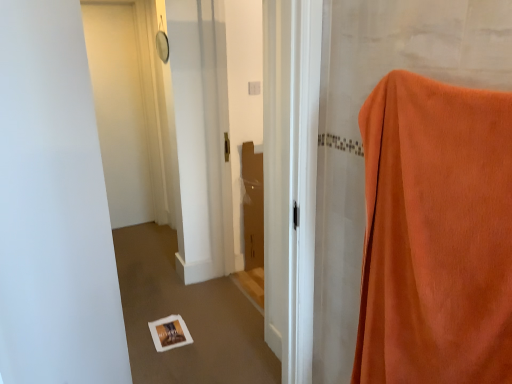
Question: Considering the relative sizes of orange velvety curtain at right and white matte door at upper left in the image provided, is orange velvety curtain at right bigger than white matte door at upper left?

Choices:
 (A) no
 (B) yes

Answer: (B)

Question: From the image's perspective, is orange velvety curtain at right over white matte door at upper left?

Choices:
 (A) no
 (B) yes

Answer: (A)

Question: From a real-world perspective, is orange velvety curtain at right located beneath white matte door at upper left?

Choices:
 (A) yes
 (B) no

Answer: (A)

Question: Is orange velvety curtain at right not close to white matte door at upper left?

Choices:
 (A) yes
 (B) no

Answer: (A)

Question: Is orange velvety curtain at right outside white matte door at upper left?

Choices:
 (A) no
 (B) yes

Answer: (B)

Question: Is orange velvety curtain at right next to white matte door at upper left and touching it?

Choices:
 (A) no
 (B) yes

Answer: (A)

Question: Is white matte door at upper left smaller than orange velvety curtain at right?

Choices:
 (A) yes
 (B) no

Answer: (A)

Question: From a real-world perspective, is white matte door at upper left beneath orange velvety curtain at right?

Choices:
 (A) yes
 (B) no

Answer: (B)

Question: Is white matte door at upper left taller than orange velvety curtain at right?

Choices:
 (A) yes
 (B) no

Answer: (A)

Question: Is white matte door at upper left far away from orange velvety curtain at right?

Choices:
 (A) yes
 (B) no

Answer: (A)

Question: Does white matte door at upper left lie in front of orange velvety curtain at right?

Choices:
 (A) yes
 (B) no

Answer: (B)

Question: From the image's perspective, is white matte door at upper left over orange velvety curtain at right?

Choices:
 (A) yes
 (B) no

Answer: (A)

Question: From a real-world perspective, is orange velvety curtain at right positioned above or below white matte door at upper left?

Choices:
 (A) above
 (B) below

Answer: (B)